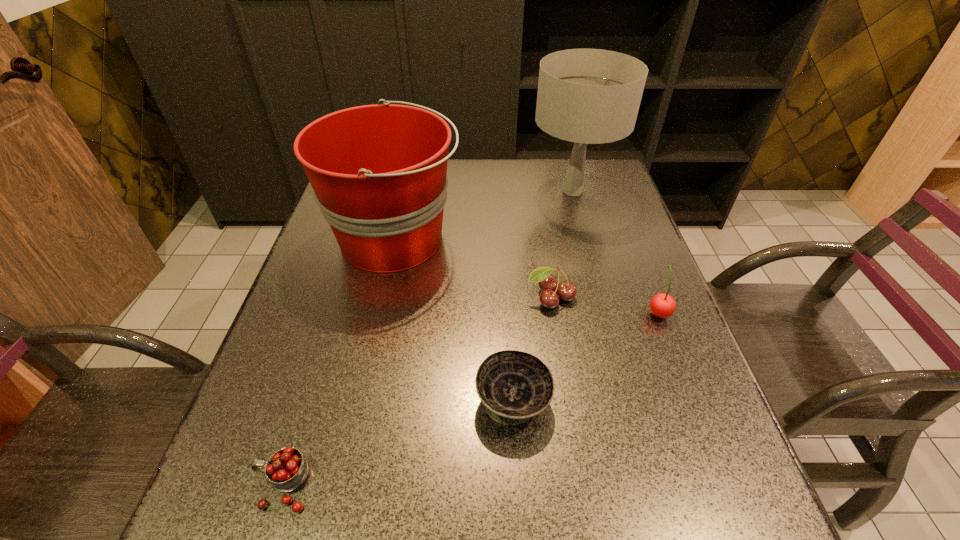
Where is `vacant space located on the front-facing side of the tallest object`? Image resolution: width=960 pixels, height=540 pixels. vacant space located on the front-facing side of the tallest object is located at coordinates (484, 191).

Find the location of `vacant space located on the front-facing side of the tallest object`. vacant space located on the front-facing side of the tallest object is located at coordinates (448, 191).

The height and width of the screenshot is (540, 960). What are the coordinates of `vacant space positioned 0.190m on the back of the bucket` in the screenshot? It's located at (410, 168).

You are a GUI agent. You are given a task and a screenshot of the screen. Output one action in this format:
    pyautogui.click(x=<x>, y=<y>)
    Task: Click on the free spot located 0.300m on the left of the fourth shortest object
    
    Given the screenshot: What is the action you would take?
    click(515, 312)

Identify the location of blank space located on the leaves of the second cherry from right to left. (556, 330).

Identify the location of free spot located 0.290m on the back of the bowl. This screenshot has width=960, height=540. (505, 272).

Locate an element on the screen. object that is at the far edge is located at coordinates (587, 96).

At what (x,y) coordinates should I click in order to perform the action: click on object present at the near edge. Please return your answer as a coordinate pair (x, y). This screenshot has width=960, height=540. Looking at the image, I should click on (286, 469).

Find the location of a particular element. The width and height of the screenshot is (960, 540). bucket located in the left edge section of the desktop is located at coordinates (379, 172).

Where is `cherry located at the left edge`? The height and width of the screenshot is (540, 960). cherry located at the left edge is located at coordinates (286, 469).